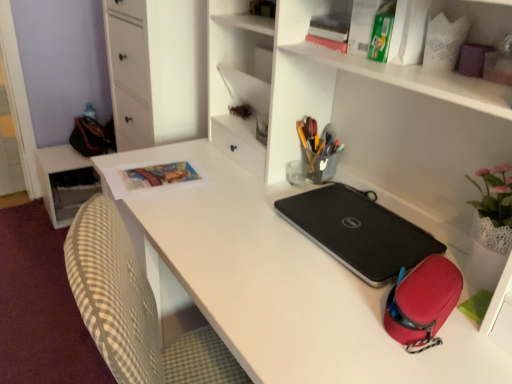
Locate an element on the screen. vacant area on top of black textured laptop at center (from a real-world perspective) is located at coordinates pyautogui.click(x=362, y=225).